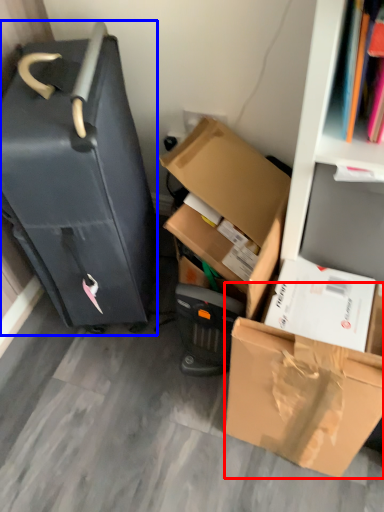
Question: Among these objects, which one is nearest to the camera, box (highlighted by a red box) or suitcase (highlighted by a blue box)?

Choices:
 (A) box
 (B) suitcase

Answer: (A)